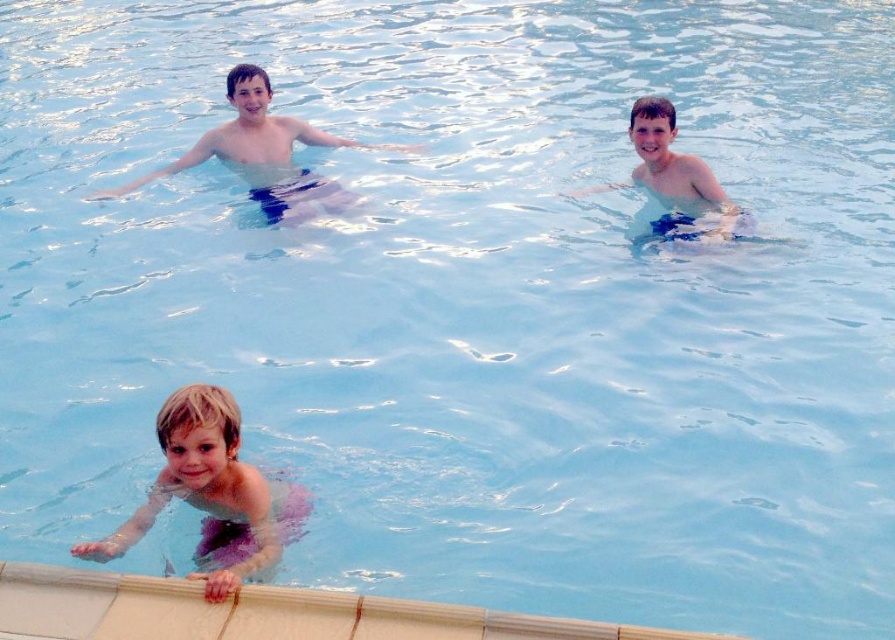
Is point (224, 154) positioned before point (739, 224)?

No, it is behind (739, 224).

Can you confirm if matte blue shorts at upper center is bigger than blue fabric shorts at upper center?

Yes.

Which is in front, point (232, 129) or point (693, 212)?

Point (693, 212)

The height and width of the screenshot is (640, 895). Identify the location of matte blue shorts at upper center. (263, 152).

Is pink fabric at lower left positioned at the back of matte blue shorts at upper center?

No.

Between pink fabric at lower left and matte blue shorts at upper center, which one appears on the right side from the viewer's perspective?

Positioned to the right is pink fabric at lower left.

Measure the distance between point [210,392] and camera.

A distance of 25.43 feet exists between point [210,392] and camera.

Locate an element on the screen. pink fabric at lower left is located at coordinates (212, 493).

Does pink fabric at lower left have a smaller size compared to blue fabric shorts at upper center?

Indeed, pink fabric at lower left has a smaller size compared to blue fabric shorts at upper center.

Is pink fabric at lower left positioned behind blue fabric shorts at upper center?

Result: No, pink fabric at lower left is in front of blue fabric shorts at upper center.

Does point (88, 547) lie behind point (696, 225)?

That is False.

You are a GUI agent. You are given a task and a screenshot of the screen. Output one action in this format:
    pyautogui.click(x=<x>, y=<y>)
    Task: Click on the pink fabric at lower left
    The height and width of the screenshot is (640, 895).
    Given the screenshot: What is the action you would take?
    pyautogui.click(x=212, y=493)